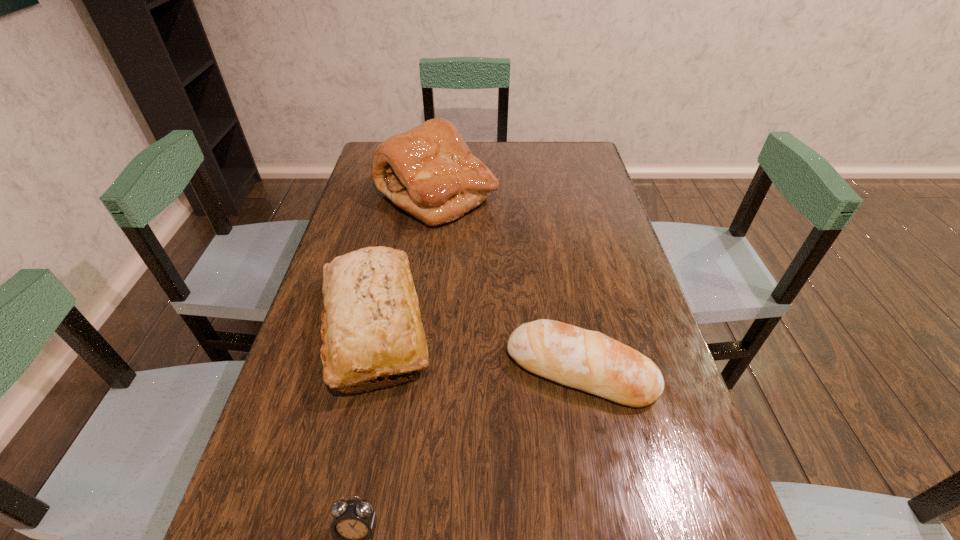
Where is `vacant space that satisfies the following two spatial constraints: 1. on the filling side of the tallest bread; 2. on the right side of the shortest bread`? This screenshot has width=960, height=540. vacant space that satisfies the following two spatial constraints: 1. on the filling side of the tallest bread; 2. on the right side of the shortest bread is located at coordinates (414, 370).

You are a GUI agent. You are given a task and a screenshot of the screen. Output one action in this format:
    pyautogui.click(x=<x>, y=<y>)
    Task: Click on the free space in the image that satisfies the following two spatial constraints: 1. on the filling side of the tallest bread; 2. on the right side of the shortest bread
    
    Given the screenshot: What is the action you would take?
    pyautogui.click(x=414, y=370)